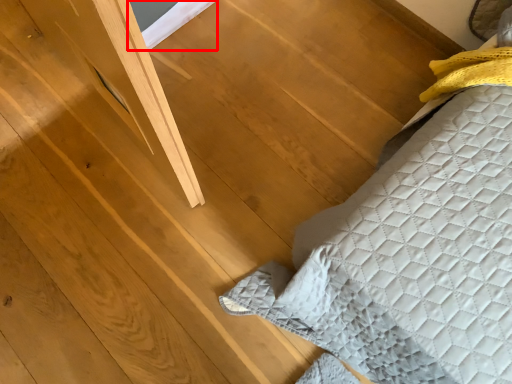
Question: From the image's perspective, what is the correct spatial relationship of window (annotated by the red box) in relation to furniture?

Choices:
 (A) below
 (B) above

Answer: (B)